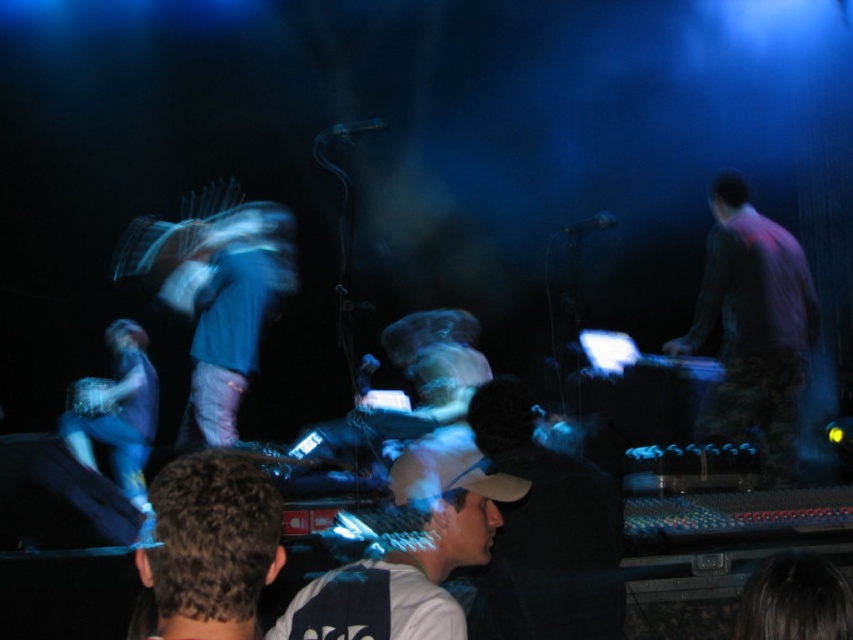
You are a photographer at the back of the venue and want to capture a photo of the purple shirt at right and denim pants at left in the same frame. The camera you have can focus on objects within a 3.5 meter range. Will both subjects be within the camera range?

The purple shirt at right is 2.81 meters from denim pants at left. Since the camera can focus within 3.5 meters, both subjects are within the 3.5 meter range and can be captured in the same frame.